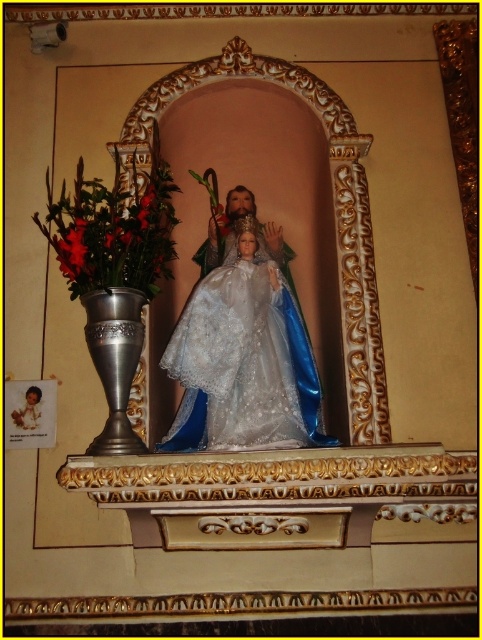
Is point (270, 321) more distant than point (78, 216)?

No, it is in front of (78, 216).

Is satin white gown at center closer to the viewer compared to metallic vase at left?

Yes, it is in front of metallic vase at left.

Find the location of a particular element. satin white gown at center is located at coordinates (242, 362).